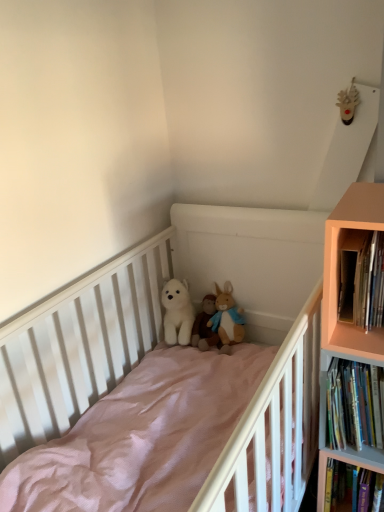
Question: Considering the relative sizes of white matte crib at center and pale orange wood bookcase at right in the image provided, is white matte crib at center smaller than pale orange wood bookcase at right?

Choices:
 (A) yes
 (B) no

Answer: (B)

Question: Is white matte crib at center not near pale orange wood bookcase at right?

Choices:
 (A) no
 (B) yes

Answer: (A)

Question: Is white matte crib at center closer to camera compared to pale orange wood bookcase at right?

Choices:
 (A) no
 (B) yes

Answer: (B)

Question: Can you confirm if white matte crib at center is wider than pale orange wood bookcase at right?

Choices:
 (A) yes
 (B) no

Answer: (A)

Question: Can you confirm if white matte crib at center is bigger than pale orange wood bookcase at right?

Choices:
 (A) no
 (B) yes

Answer: (B)

Question: Considering the relative positions of white matte crib at center and pale orange wood bookcase at right in the image provided, is white matte crib at center behind pale orange wood bookcase at right?

Choices:
 (A) no
 (B) yes

Answer: (A)

Question: Is pale orange wood bookcase at right to the right of fluffy white stuffed animal at center, positioned as the first toy in right-to-left order, from the viewer's perspective?

Choices:
 (A) yes
 (B) no

Answer: (A)

Question: Would you say fluffy white stuffed animal at center, the third toy viewed from the left, is part of pale orange wood bookcase at right's contents?

Choices:
 (A) no
 (B) yes

Answer: (A)

Question: Can you confirm if pale orange wood bookcase at right is smaller than fluffy white stuffed animal at center, positioned as the first toy in right-to-left order?

Choices:
 (A) no
 (B) yes

Answer: (A)

Question: Considering the relative sizes of pale orange wood bookcase at right and fluffy white stuffed animal at center, positioned as the first toy in right-to-left order, in the image provided, is pale orange wood bookcase at right shorter than fluffy white stuffed animal at center, positioned as the first toy in right-to-left order,?

Choices:
 (A) no
 (B) yes

Answer: (A)

Question: Is pale orange wood bookcase at right at the left side of fluffy white stuffed animal at center, positioned as the first toy in right-to-left order?

Choices:
 (A) yes
 (B) no

Answer: (B)

Question: Is pale orange wood bookcase at right in front of fluffy white stuffed animal at center, the third toy viewed from the left?

Choices:
 (A) yes
 (B) no

Answer: (A)

Question: Is hardcover books at right, placed as the first book when sorted from top to bottom, taller than white matte crib at center?

Choices:
 (A) no
 (B) yes

Answer: (A)